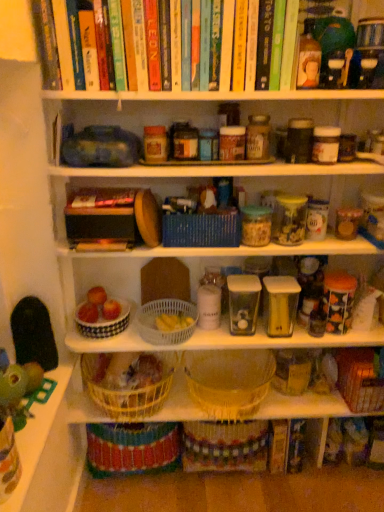
Question: From a real-world perspective, is white plastic basket at center, acting as the fourth basket starting from the right, physically located above or below hardcover book at center?

Choices:
 (A) above
 (B) below

Answer: (B)

Question: Considering the positions of point [145, 338] and point [129, 195], is point [145, 338] closer or farther from the camera than point [129, 195]?

Choices:
 (A) farther
 (B) closer

Answer: (A)

Question: Which object is positioned farthest from the transparent plastic container at center, marked as the first glass jar in a left-to-right arrangement?

Choices:
 (A) blue woven basket at center, arranged as the third basket when viewed from the right
 (B) woven brown basket at lower right, which ranks as the first basket in right-to-left order
 (C) yellow wicker basket at lower center, which is counted as the 2th basket, starting from the left
 (D) white ceramic bowl at center, which is the 1th basket from left to right
 (E) black rubber toy at left, which is the 1th toy in back-to-front order

Answer: (E)

Question: Considering the real-world distances, which object is closest to the hardcover book at center?

Choices:
 (A) woven straw basket at center, marked as the 5th basket in a left-to-right arrangement
 (B) white plastic basket at center, acting as the fourth basket starting from the right
 (C) black rubber toy at left, which is the 1th toy in back-to-front order
 (D) blue woven basket at center, arranged as the third basket when viewed from the right
 (E) transparent plastic container at center, the second glass jar viewed from the right

Answer: (D)